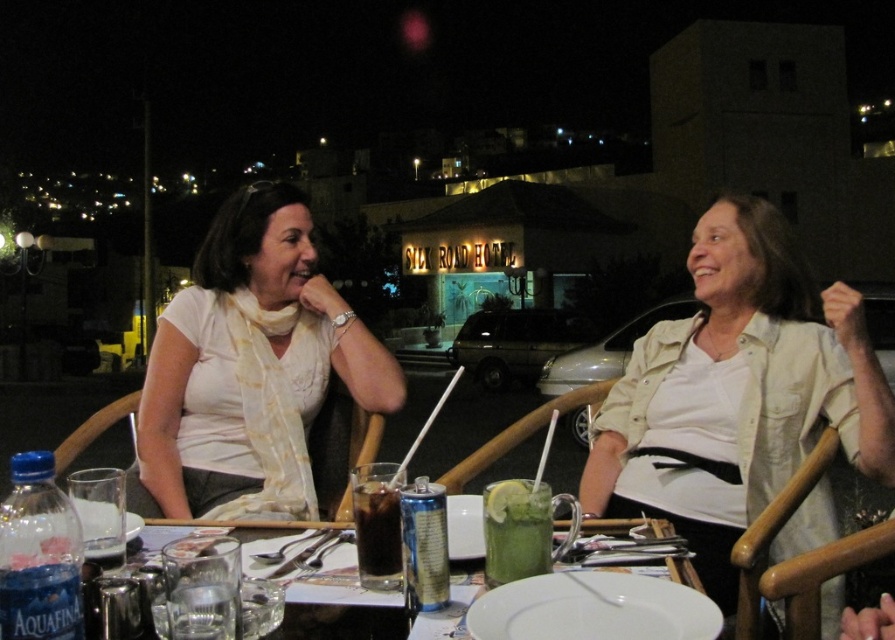
You are a waiter at the Silk Road Hotel restaurant. You need to deliver a drink to the guest wearing the beige cotton shirt at center. Where should you place the drink relative to the shirt?

The beige cotton shirt at center is located at point (738, 390), so you should place the drink near the coordinates (738, 390) where the shirt is positioned.

You are a photographer standing at the scene. You want to take a photo that includes both the beige cotton shirt at center and the white matte scarf at upper left. What is the minimum distance you need to move backward to ensure both objects are in frame?

The beige cotton shirt at center is 3.52 feet away from the white matte scarf at upper left. To include both in the photo, you need to move backward until you can frame both objects, which requires accounting for their separation distance. However, without knowing the camera sensor size or focal length, an exact distance cannot be calculated. A general rule is to ensure you are at least 3.52 feet away from the nearest object to capture both, but this may vary based on equipment.

You are a photographer taking a portrait of the two women at the table. You notice the beige cotton shirt at center and the white matte scarf at upper left in your frame. Which object should you adjust to ensure the scarf is visible above the shirt?

The beige cotton shirt at center is located below the white matte scarf at upper left, so you should adjust the beige cotton shirt at center to move it lower or the white matte scarf at upper left to move it higher to ensure visibility.